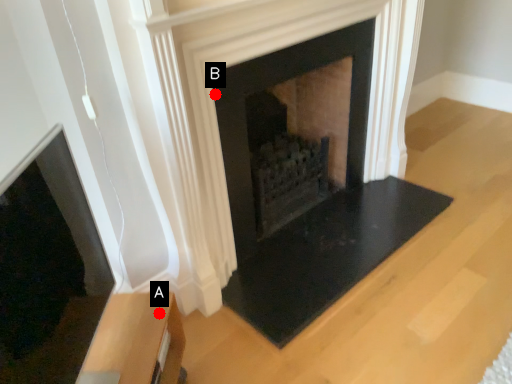
Question: Two points are circled on the image, labeled by A and B beside each circle. Which point is closer to the camera?

Choices:
 (A) A is closer
 (B) B is closer

Answer: (A)